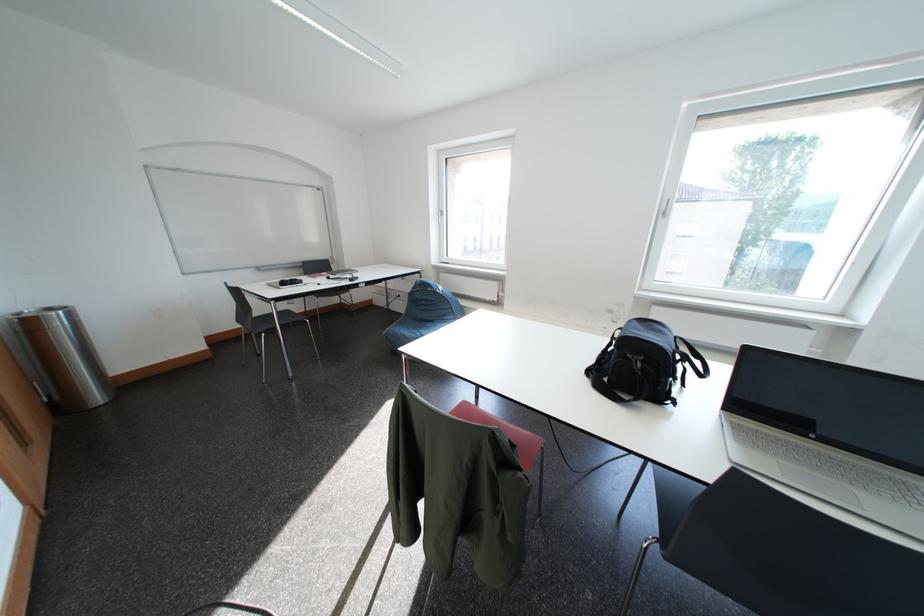
Locate an element on the screen. red chair sitting surface is located at coordinates (518, 439).